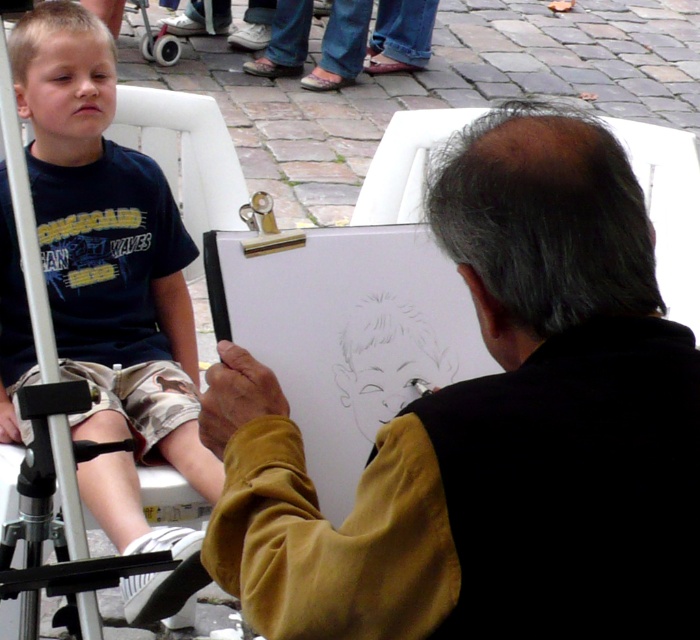
Does smooth black jacket at center appear over matte black shorts at left?

No.

What do you see at coordinates (494, 429) in the screenshot?
I see `smooth black jacket at center` at bounding box center [494, 429].

Describe the element at coordinates (494, 429) in the screenshot. This screenshot has width=700, height=640. I see `smooth black jacket at center` at that location.

Locate an element on the screen. The width and height of the screenshot is (700, 640). smooth black jacket at center is located at coordinates (494, 429).